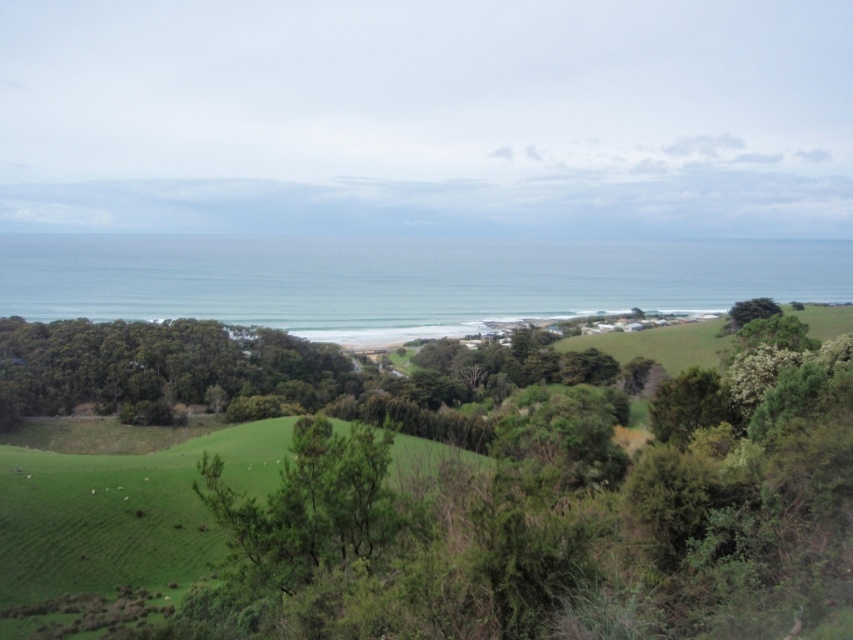
Question: Does green leafy tree at center appear on the right side of green leafy tree at right?

Choices:
 (A) yes
 (B) no

Answer: (B)

Question: Which object is closer to the camera taking this photo?

Choices:
 (A) green leafy tree at right
 (B) green leafy tree at center

Answer: (B)

Question: Among these objects, which one is nearest to the camera?

Choices:
 (A) green leafy tree at right
 (B) green leafy tree at center

Answer: (B)

Question: Can you confirm if green leafy tree at center is wider than green leafy tree at right?

Choices:
 (A) no
 (B) yes

Answer: (A)

Question: Is green leafy tree at center closer to the viewer compared to green leafy tree at right?

Choices:
 (A) no
 (B) yes

Answer: (B)